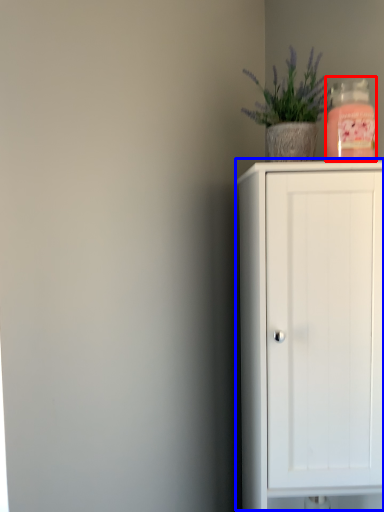
Question: Among these objects, which one is farthest to the camera, bottle (highlighted by a red box) or cupboard (highlighted by a blue box)?

Choices:
 (A) bottle
 (B) cupboard

Answer: (A)